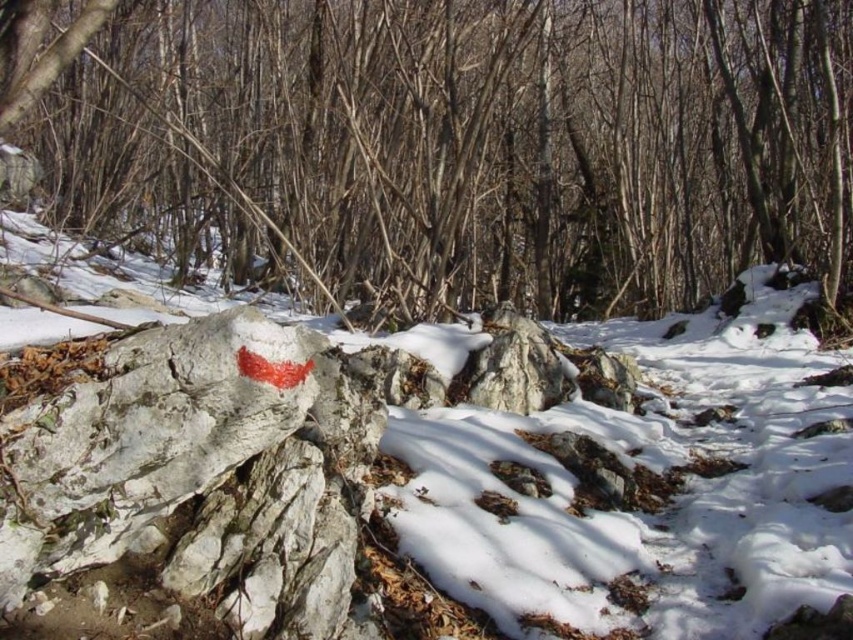
Question: Which object is the closest to the smooth bark tree at center?

Choices:
 (A) speckled gray rock at center
 (B) white rough rock at center
 (C) white matte rock at center

Answer: (A)

Question: Does white rough rock at center appear over speckled gray rock at center?

Choices:
 (A) no
 (B) yes

Answer: (A)

Question: Among these points, which one is farthest from the camera?

Choices:
 (A) (479, 356)
 (B) (369, 408)
 (C) (595, 81)
 (D) (732, 545)

Answer: (C)

Question: Which object is the farthest from the white matte rock at center?

Choices:
 (A) smooth bark tree at center
 (B) speckled gray rock at center
 (C) white rough rock at center

Answer: (A)

Question: Does white rough rock at center appear on the left side of speckled gray rock at center?

Choices:
 (A) yes
 (B) no

Answer: (A)

Question: Can you confirm if smooth bark tree at center is positioned to the left of speckled gray rock at center?

Choices:
 (A) yes
 (B) no

Answer: (A)